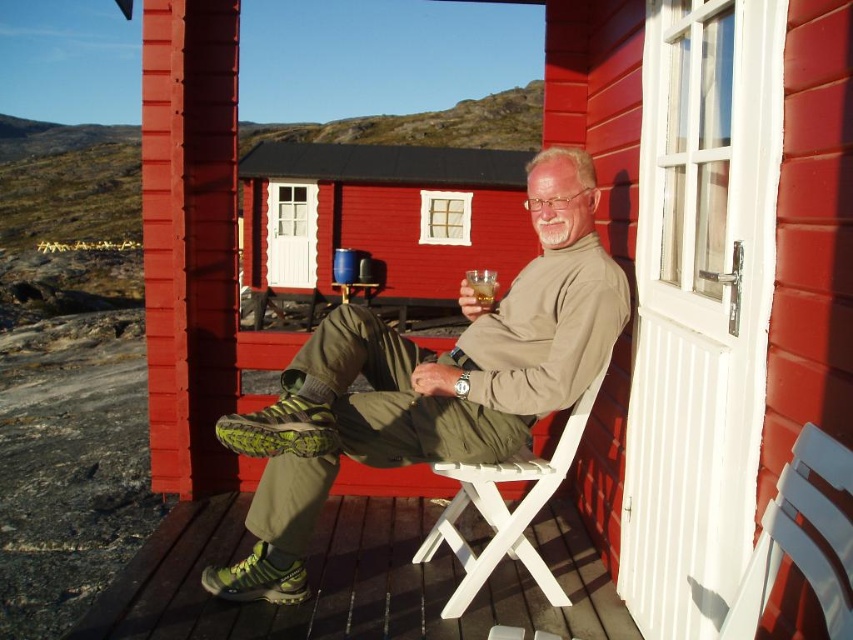
Is khaki cotton shirt at center positioned before brown wooden porch at lower left?

Yes.

Is khaki cotton shirt at center wider than brown wooden porch at lower left?

No, khaki cotton shirt at center is not wider than brown wooden porch at lower left.

This screenshot has width=853, height=640. What do you see at coordinates (428, 381) in the screenshot?
I see `khaki cotton shirt at center` at bounding box center [428, 381].

This screenshot has height=640, width=853. In order to click on khaki cotton shirt at center in this screenshot , I will do `click(428, 381)`.

Is point (546, 198) less distant than point (587, 417)?

Yes, point (546, 198) is in front of point (587, 417).

Which is above, khaki cotton shirt at center or white plastic chair at center?

khaki cotton shirt at center

Measure the distance between khaki cotton shirt at center and camera.

The distance of khaki cotton shirt at center from camera is 2.08 meters.

The width and height of the screenshot is (853, 640). Find the location of `khaki cotton shirt at center`. khaki cotton shirt at center is located at coordinates (428, 381).

How distant is white plastic chair at lower right from translucent glass at center?

The distance of white plastic chair at lower right from translucent glass at center is 4.87 feet.

Is white plastic chair at lower right positioned in front of translucent glass at center?

Yes, it is in front of translucent glass at center.

Is point (787, 474) more distant than point (485, 276)?

That is False.

At what (x,y) coordinates should I click in order to perform the action: click on white plastic chair at lower right. Please return your answer as a coordinate pair (x, y). The image size is (853, 640). Looking at the image, I should click on (801, 538).